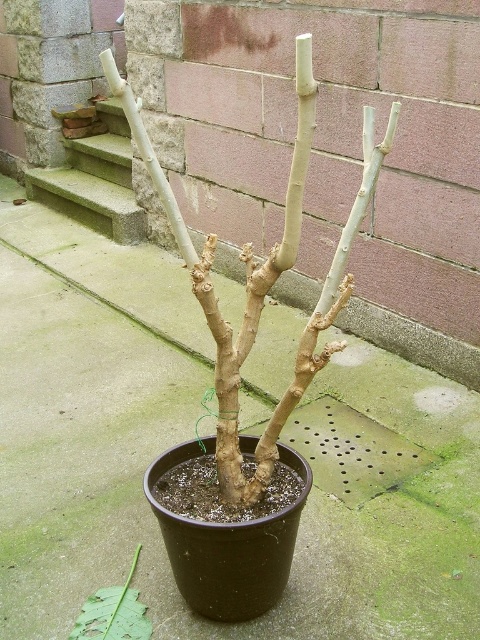
How much distance is there between smooth beige branches at center and green leafy stem at center?

smooth beige branches at center is 23.54 inches away from green leafy stem at center.

Looking at this image, is smooth beige branches at center taller than green leafy stem at center?

Yes, smooth beige branches at center is taller than green leafy stem at center.

Measure the distance between smooth beige branches at center and camera.

33.91 inches

I want to click on smooth beige branches at center, so click(262, 275).

Can you confirm if smooth beige branches at center is positioned below green concrete stairs at upper left?

Yes, smooth beige branches at center is below green concrete stairs at upper left.

Based on the photo, is smooth beige branches at center smaller than green concrete stairs at upper left?

Yes.

This screenshot has width=480, height=640. I want to click on smooth beige branches at center, so click(x=262, y=275).

Where is `smooth beige branches at center`? The width and height of the screenshot is (480, 640). smooth beige branches at center is located at coordinates (262, 275).

Which is above, green concrete stairs at upper left or green leafy stem at center?

green concrete stairs at upper left

Between point (68, 211) and point (94, 611), which one is positioned in front?

Point (94, 611)

Find the location of a particular element. The height and width of the screenshot is (640, 480). green concrete stairs at upper left is located at coordinates (95, 180).